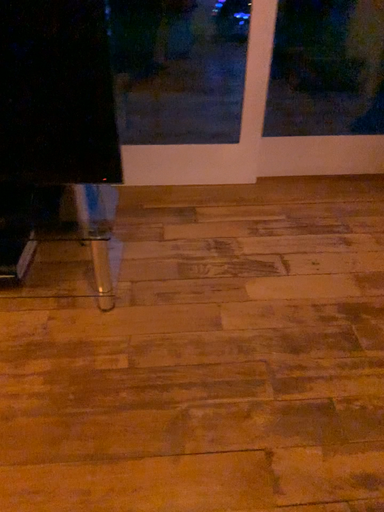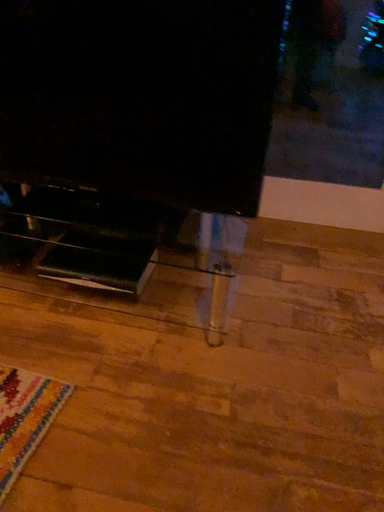
Question: Which way did the camera rotate in the video?

Choices:
 (A) rotated right
 (B) rotated left

Answer: (B)